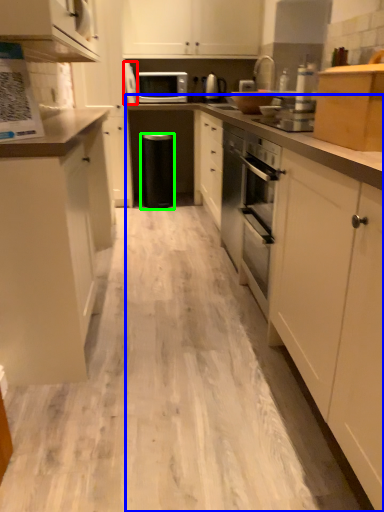
Question: Which is nearer to the appliance (highlighted by a red box)? countertop (highlighted by a blue box) or dish washer (highlighted by a green box).

Choices:
 (A) countertop
 (B) dish washer

Answer: (B)